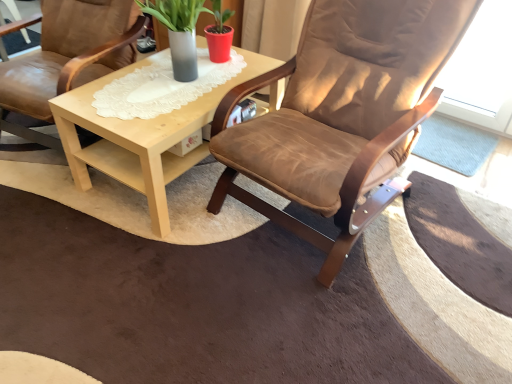
What are the coordinates of `free point above light wood/texture coffee table at center (from a real-world perspective)` in the screenshot? It's located at (160, 85).